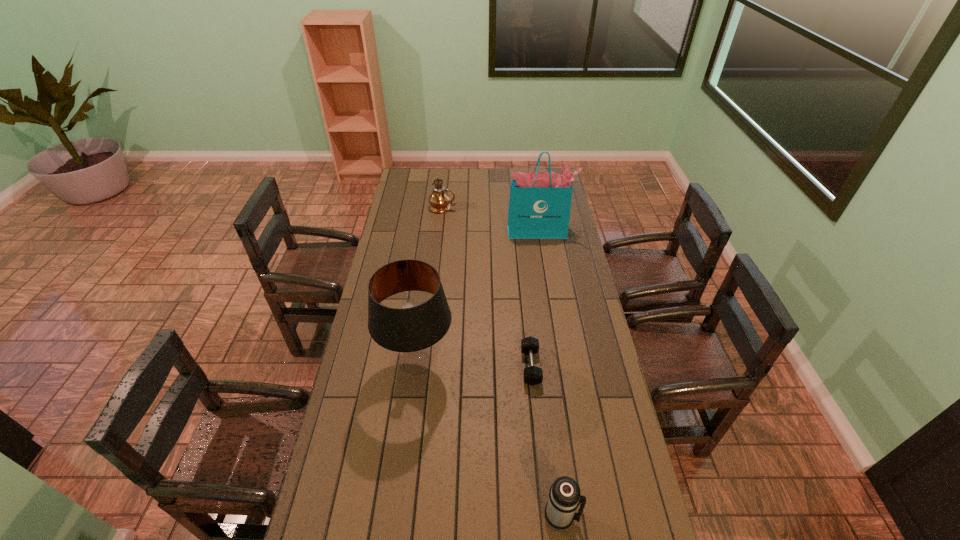
This screenshot has height=540, width=960. I want to click on vacant space situated on the side with the handle of the fourth tallest object, so click(x=596, y=517).

Locate an element on the screen. free space located on the front of the dumbbell is located at coordinates (539, 443).

Image resolution: width=960 pixels, height=540 pixels. In order to click on object at the left edge in this screenshot , I will do `click(412, 338)`.

Locate an element on the screen. The height and width of the screenshot is (540, 960). object present at the right edge is located at coordinates (540, 202).

Where is `vacant position at the far edge of the desktop`? vacant position at the far edge of the desktop is located at coordinates (x=491, y=175).

At what (x,y) coordinates should I click in order to perform the action: click on free location at the left edge. Please return your answer as a coordinate pair (x, y). The height and width of the screenshot is (540, 960). Looking at the image, I should click on (x=393, y=304).

At what (x,y) coordinates should I click in order to perform the action: click on free space at the right edge. Please return your answer as a coordinate pair (x, y). Image resolution: width=960 pixels, height=540 pixels. Looking at the image, I should click on (628, 473).

The height and width of the screenshot is (540, 960). Identify the location of free space between the farthest object and the fourth nearest object. (491, 219).

Where is `vacant area that lies between the shopping bag and the third tallest object`? This screenshot has width=960, height=540. vacant area that lies between the shopping bag and the third tallest object is located at coordinates (491, 219).

Locate an element on the screen. empty space between the fourth nearest object and the shortest object is located at coordinates (535, 299).